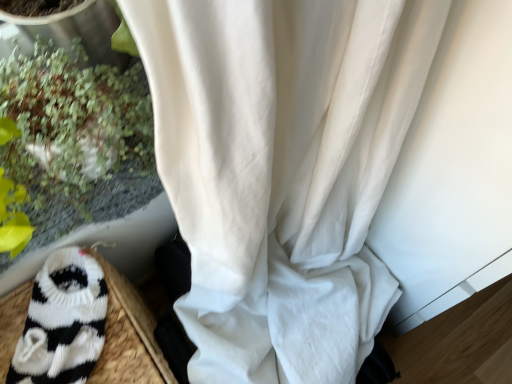
Question: From a real-world perspective, is green leafy plant at left physically located above or below white sheer curtain at center?

Choices:
 (A) below
 (B) above

Answer: (B)

Question: Based on their sizes in the image, would you say green leafy plant at left is bigger or smaller than white sheer curtain at center?

Choices:
 (A) big
 (B) small

Answer: (B)

Question: Estimate the real-world distances between objects in this image. Which object is farther from the white sheer curtain at center?

Choices:
 (A) black knitted sock at lower left
 (B) green leafy plant at left

Answer: (A)

Question: Which is farther from the black knitted sock at lower left?

Choices:
 (A) white sheer curtain at center
 (B) green leafy plant at left

Answer: (A)